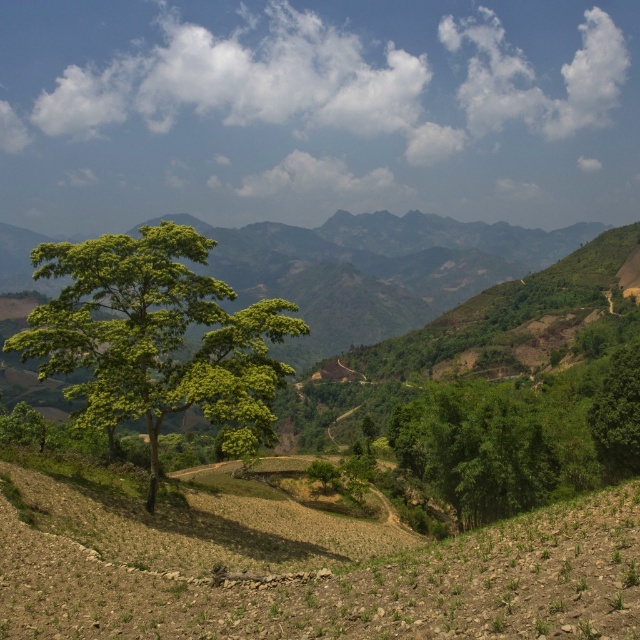
You are standing at the center of the image and want to locate the green leafy tree at center. According to the coordinates, in which direction should you look to find it?

The green leafy tree at center is located at coordinates 0.528 on the x axis and 0.245 on the y axis. Since the center of the image is at 0.5 on both axes, the tree is slightly to the right and above the center point. Therefore, you should look slightly to the right and upwards from the exact center to locate it.

You are standing in the rural landscape and want to walk towards the green leafy tree at center and the green leafy tree at right. Which tree will you reach first?

The green leafy tree at center is closer to the viewer than the green leafy tree at right, so you will reach the green leafy tree at center first.

You are a hiker who wants to take a photo of both the green leafy tree at center and the green leafy tree at right in the same frame. Which tree should you move closer to in order to include both trees in your photo?

You should move closer to the green leafy tree at right because it is smaller in size compared to the green leafy tree at center. By moving closer to the smaller tree, you can better balance their sizes in the photo frame, ensuring both are visible and well composed.